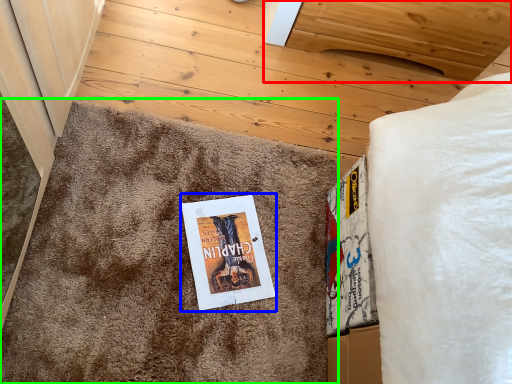
Question: Estimate the real-world distances between objects in this image. Which object is farther from furniture (highlighted by a red box), fiction book (highlighted by a blue box) or doormat (highlighted by a green box)?

Choices:
 (A) fiction book
 (B) doormat

Answer: (A)